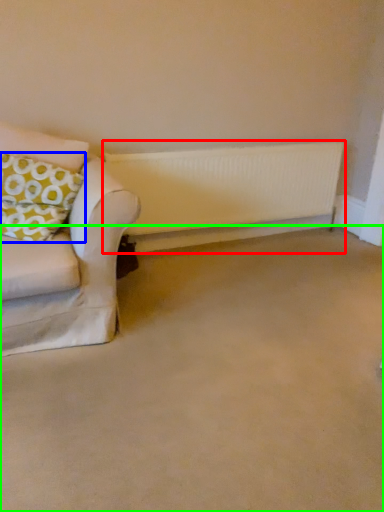
Question: Which is nearer to the radiator (highlighted by a red box)? pillow (highlighted by a blue box) or plain (highlighted by a green box).

Choices:
 (A) pillow
 (B) plain

Answer: (A)